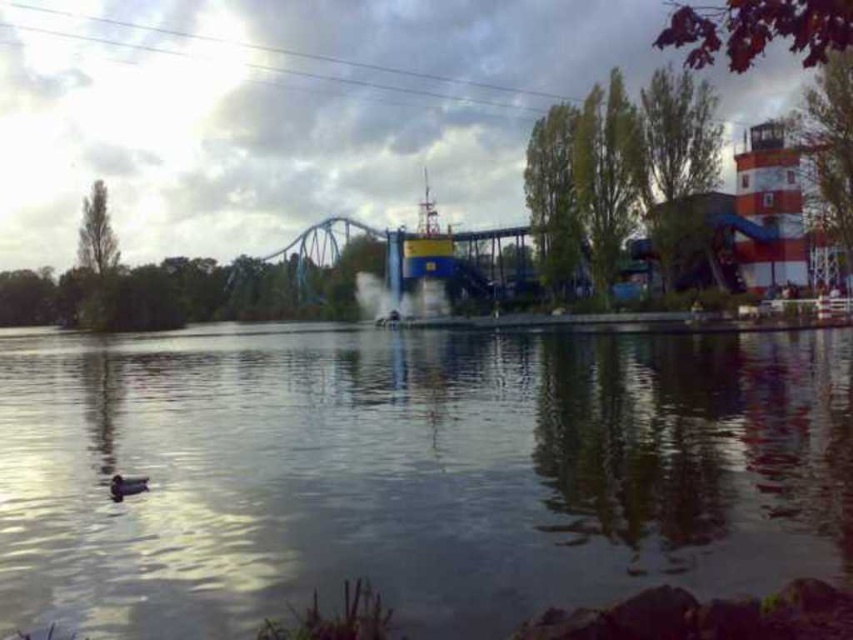
Who is lower down, smooth water at center or brown matte duck at lower left?

brown matte duck at lower left is lower down.

Between smooth water at center and brown matte duck at lower left, which one has less height?

With less height is brown matte duck at lower left.

The width and height of the screenshot is (853, 640). Describe the element at coordinates (410, 472) in the screenshot. I see `smooth water at center` at that location.

Find the location of a particular element. Image resolution: width=853 pixels, height=640 pixels. smooth water at center is located at coordinates (410, 472).